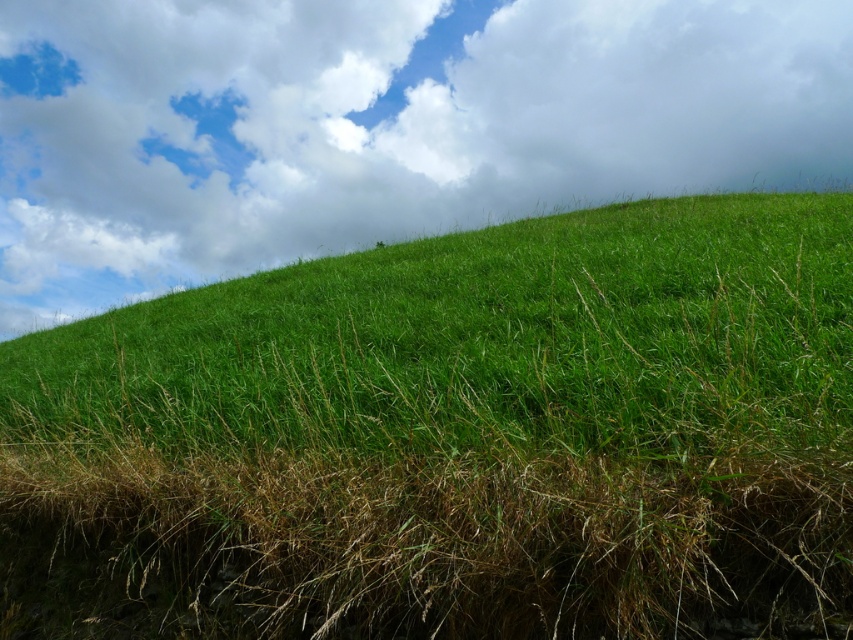
You are standing at the base of the hill and looking towards the top. There are two points marked on the image, point [630,264] and point [114,209]. Which point is closer to you?

Point [630,264] is closer to the camera than point [114,209], so the point closer to you is point [630,264].

You are standing on the green grassy hill at center and looking up at the white fluffy cloud at upper center. Which object appears larger in the sky?

The white fluffy cloud at upper center appears larger than the green grassy hill at center because the green grassy hill at center is smaller than the white fluffy cloud at upper center according to their sizes.

You are a drone operator trying to capture a photo of the green grassy hill at center and the white fluffy cloud at upper center. Which object will appear smaller in the photo?

The green grassy hill at center will appear smaller in the photo because it is thinner than the white fluffy cloud at upper center.